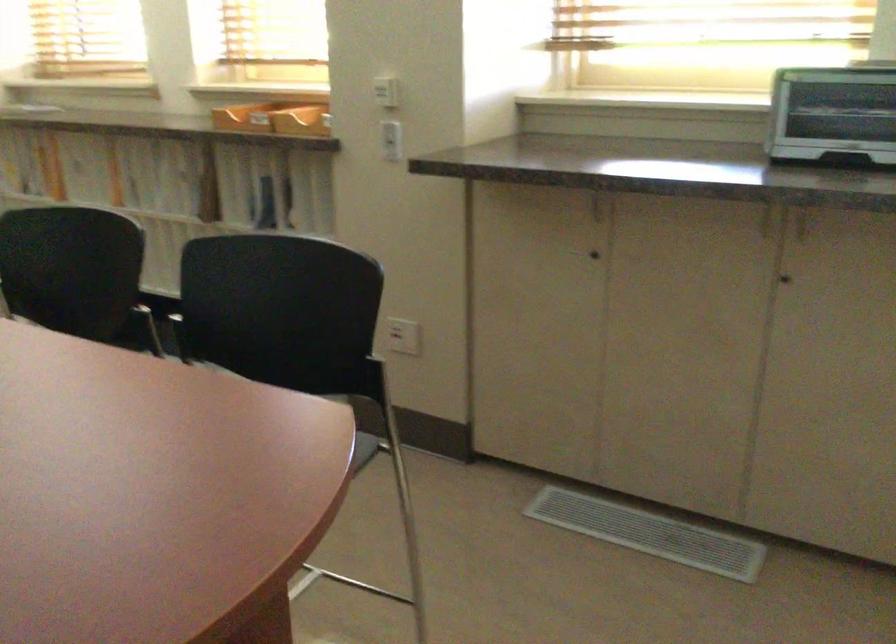
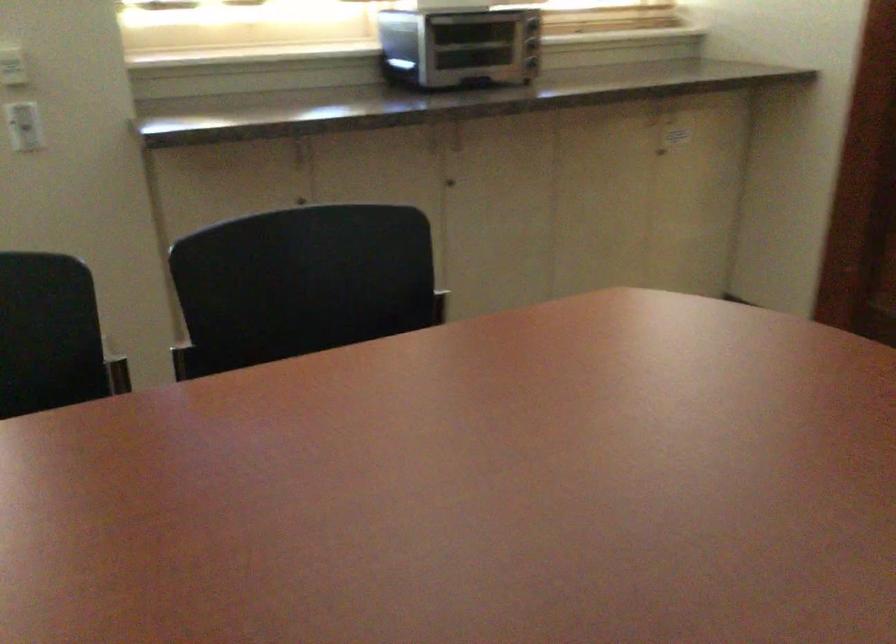
In the second image, find the point that corresponds to (x=388, y=86) in the first image.

(11, 62)